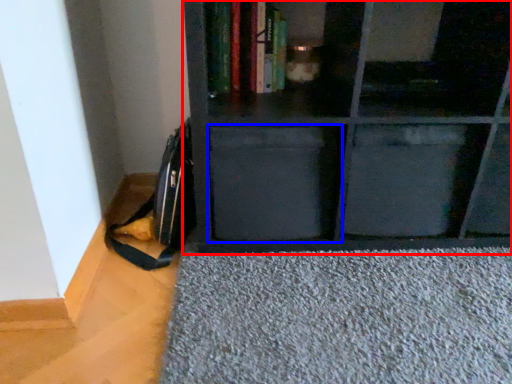
Question: Among these objects, which one is farthest to the camera, shelf (highlighted by a red box) or drawer (highlighted by a blue box)?

Choices:
 (A) shelf
 (B) drawer

Answer: (B)